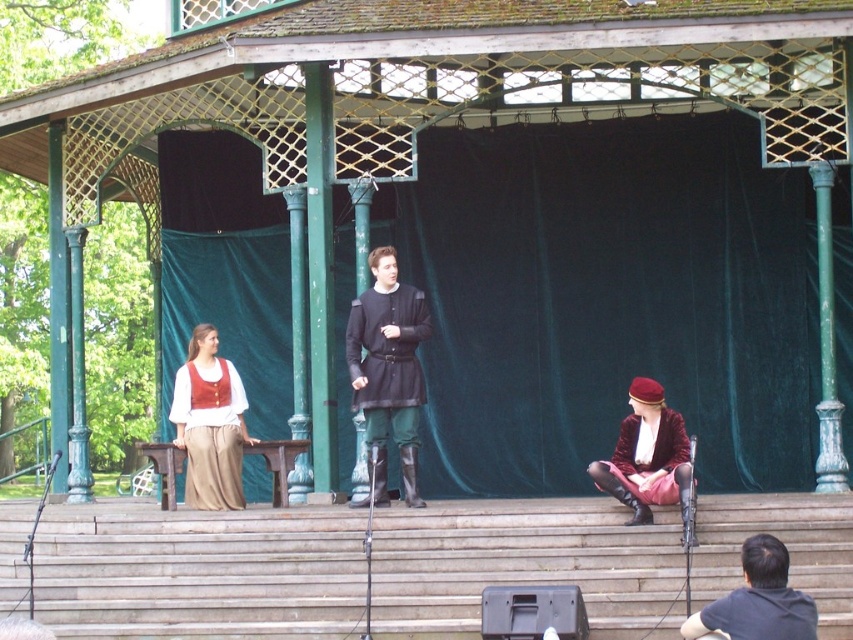
Can you confirm if wooden stairs at center is wider than velvet maroon coat at lower right?

Correct, the width of wooden stairs at center exceeds that of velvet maroon coat at lower right.

Who is lower down, wooden stairs at center or velvet maroon coat at lower right?

wooden stairs at center is below.

Which is behind, point (62, 618) or point (656, 502)?

The point (656, 502) is more distant.

At what (x,y) coordinates should I click in order to perform the action: click on wooden stairs at center. Please return your answer as a coordinate pair (x, y). This screenshot has width=853, height=640. Looking at the image, I should click on (199, 572).

Is point (370, 394) more distant than point (753, 609)?

That is True.

Does matte black tunic at center have a lesser width compared to dark gray shirt at lower right?

Yes, matte black tunic at center is thinner than dark gray shirt at lower right.

You are a GUI agent. You are given a task and a screenshot of the screen. Output one action in this format:
    pyautogui.click(x=<x>, y=<y>)
    Task: Click on the matte black tunic at center
    
    Given the screenshot: What is the action you would take?
    pyautogui.click(x=387, y=372)

What are the coordinates of `matte black tunic at center` in the screenshot? It's located at (387, 372).

Can you confirm if wooden stairs at center is positioned below matte black tunic at center?

Indeed, wooden stairs at center is positioned under matte black tunic at center.

Where is `wooden stairs at center`? This screenshot has height=640, width=853. wooden stairs at center is located at coordinates (199, 572).

This screenshot has width=853, height=640. I want to click on wooden stairs at center, so click(199, 572).